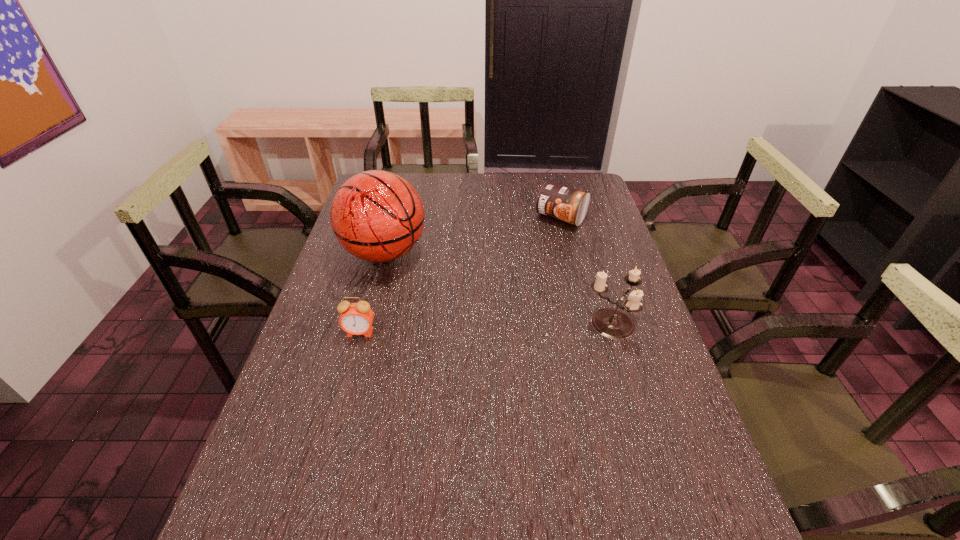
The image size is (960, 540). I want to click on alarm clock, so click(x=356, y=318).

Image resolution: width=960 pixels, height=540 pixels. Identify the location of the second tallest object. (612, 323).

Locate an element on the screen. The image size is (960, 540). basketball is located at coordinates (377, 216).

The height and width of the screenshot is (540, 960). Identify the location of can. (560, 202).

Image resolution: width=960 pixels, height=540 pixels. In order to click on free space located 0.120m on the face of the alarm clock in this screenshot , I will do `click(348, 376)`.

You are a GUI agent. You are given a task and a screenshot of the screen. Output one action in this format:
    pyautogui.click(x=<x>, y=<y>)
    Task: Click on the vacant region located on the back of the candle holder
    This screenshot has height=540, width=960.
    Given the screenshot: What is the action you would take?
    pyautogui.click(x=593, y=266)

Where is `vacant space located on the side with spill of the tallest object`? This screenshot has height=540, width=960. vacant space located on the side with spill of the tallest object is located at coordinates (476, 319).

You are a GUI agent. You are given a task and a screenshot of the screen. Output one action in this format:
    pyautogui.click(x=<x>, y=<y>)
    Task: Click on the vacant space situated on the side with spill of the tallest object
    The width and height of the screenshot is (960, 540).
    Given the screenshot: What is the action you would take?
    pyautogui.click(x=438, y=292)

Find the location of `vacant space located 0.220m on the side with spill of the tallest object`. vacant space located 0.220m on the side with spill of the tallest object is located at coordinates (462, 308).

You are a GUI agent. You are given a task and a screenshot of the screen. Output one action in this format:
    pyautogui.click(x=<x>, y=<y>)
    Task: Click on the vacant space located on the front label of the can
    This screenshot has width=960, height=540.
    Given the screenshot: What is the action you would take?
    pyautogui.click(x=536, y=245)